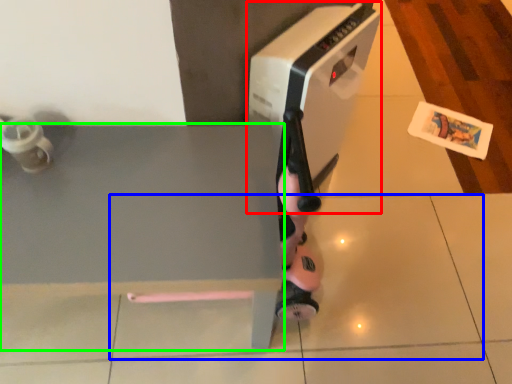
Question: Considering the real-world distances, which object is closest to home appliance (highlighted by a red box)? tile (highlighted by a blue box) or table (highlighted by a green box).

Choices:
 (A) tile
 (B) table

Answer: (B)